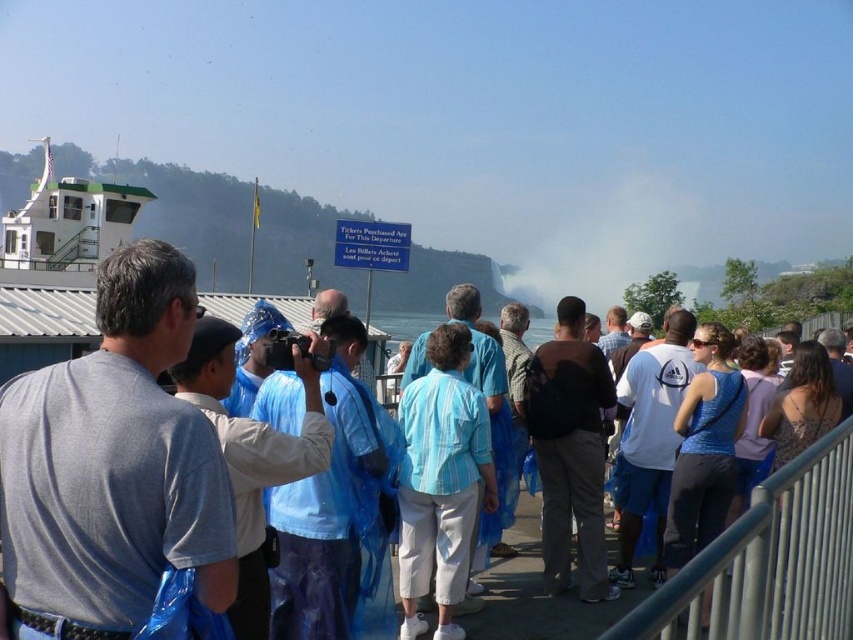
Is silver metallic railing at lower right bigger than light blue striped shirt at center?

Yes, silver metallic railing at lower right is bigger than light blue striped shirt at center.

Between silver metallic railing at lower right and light blue striped shirt at center, which one has less height?

silver metallic railing at lower right

Between point (728, 627) and point (444, 577), which one is positioned in front?

Point (728, 627) is more forward.

At what (x,y) coordinates should I click in order to perform the action: click on silver metallic railing at lower right. Please return your answer as a coordinate pair (x, y). The height and width of the screenshot is (640, 853). Looking at the image, I should click on (769, 561).

Describe the element at coordinates (440, 481) in the screenshot. Image resolution: width=853 pixels, height=640 pixels. I see `light blue striped shirt at center` at that location.

Can you confirm if light blue striped shirt at center is bigger than blue plastic bag at center?

Actually, light blue striped shirt at center might be smaller than blue plastic bag at center.

Is point (410, 538) closer to viewer compared to point (209, 390)?

No.

Identify the location of light blue striped shirt at center. (440, 481).

Identify the location of blue plastic bag at center. (253, 452).

Who is positioned more to the right, blue plastic bag at center or white mist at center?

white mist at center

Is point (308, 417) positioned after point (546, 282)?

No, it is not.

Locate an element on the screen. Image resolution: width=853 pixels, height=640 pixels. blue plastic bag at center is located at coordinates (253, 452).